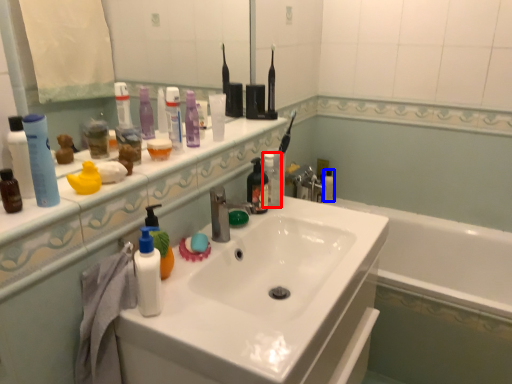
Question: Which object is further to the camera taking this photo, toiletry (highlighted by a red box) or mouthwash (highlighted by a blue box)?

Choices:
 (A) toiletry
 (B) mouthwash

Answer: (B)